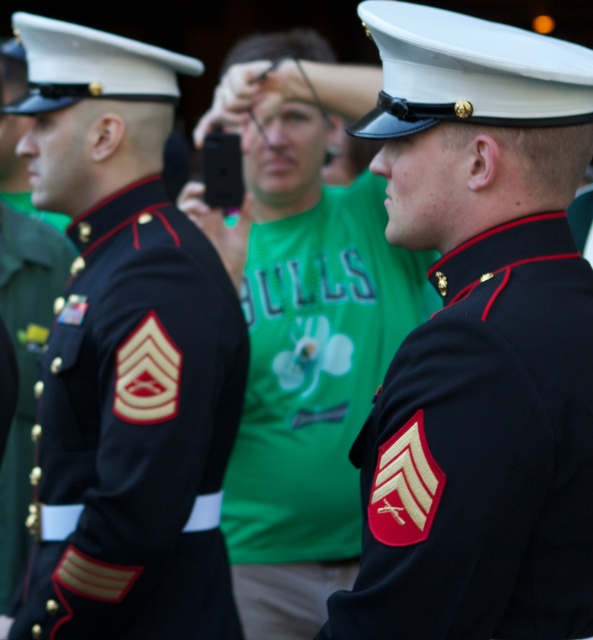
Is point (342, 236) more distant than point (49, 296)?

Yes, point (342, 236) is behind point (49, 296).

Can you confirm if dark blue fabric uniform at center is thinner than shiny black uniform at left?

Incorrect, dark blue fabric uniform at center's width is not less than shiny black uniform at left's.

You are a GUI agent. You are given a task and a screenshot of the screen. Output one action in this format:
    pyautogui.click(x=<x>, y=<y>)
    Task: Click on the dark blue fabric uniform at center
    The width and height of the screenshot is (593, 640).
    Given the screenshot: What is the action you would take?
    pyautogui.click(x=311, y=397)

Is point (431, 472) closer to camera compared to point (400, 307)?

Yes, it is in front of point (400, 307).

Which is in front, point (457, 452) or point (231, 509)?

Point (457, 452)

Which is in front, point (384, 481) or point (308, 472)?

Point (384, 481)

Identify the location of black matte uniform at center. (483, 452).

Based on the photo, which of these two, black matte uniform at center or shiny black uniform at left, stands shorter?

black matte uniform at center

Can you confirm if black matte uniform at center is positioned above shiny black uniform at left?

Yes.

Is point (482, 444) less distant than point (20, 221)?

Yes.

This screenshot has width=593, height=640. What are the coordinates of `black matte uniform at center` in the screenshot? It's located at pos(483,452).